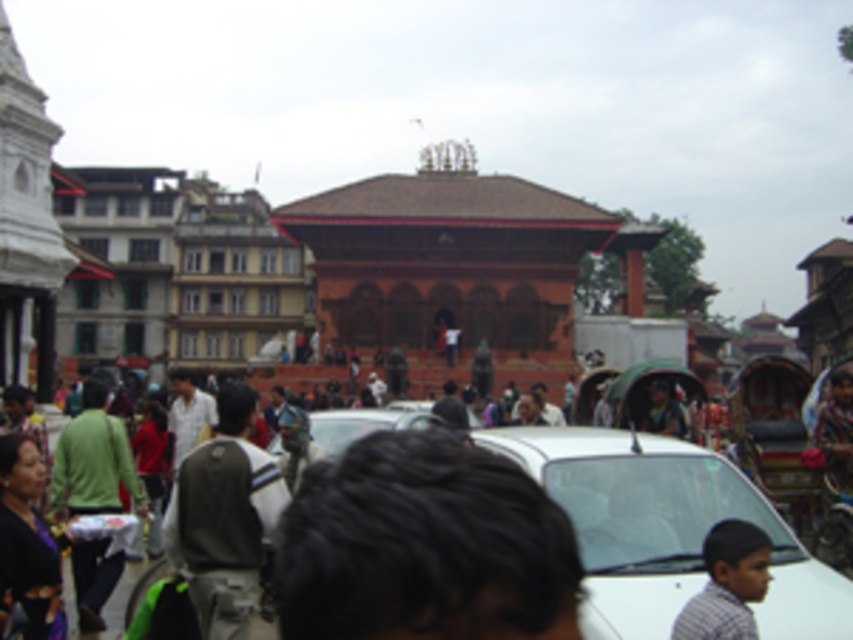
You are standing at point [517,448] and want to walk to point [430,570]. Based on the scene description, is the path between these two points clear of any obstacles?

Yes, the path between point [430,570] and point [517,448] is clear because point [430,570] is in front of point [517,448], indicating no obstruction between them.

You are standing in the urban scene and want to move from the point closer to you to the point further away. Which path should you take to go from the point at coordinates point [440,588] to the point at coordinates point [230,480]?

You should move towards the background of the image since point [440,588] is closer to the viewer than point [230,480], so moving toward the background will take you from the closer point to the farther one.